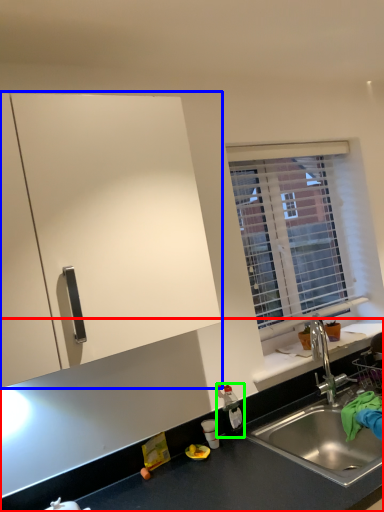
Question: Which object is the closest to the countertop (highlighted by a red box)? Choose among these: cabinetry (highlighted by a blue box) or bottle (highlighted by a green box).

Choices:
 (A) cabinetry
 (B) bottle

Answer: (B)